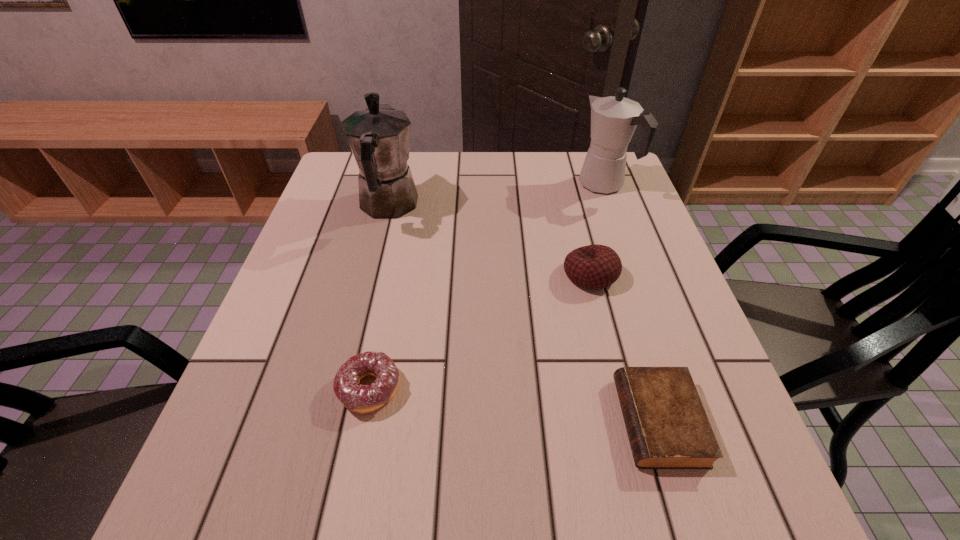
Find the location of `object that is at the far left corner`. object that is at the far left corner is located at coordinates (379, 137).

What are the coordinates of `object present at the far right corner` in the screenshot? It's located at (613, 119).

Image resolution: width=960 pixels, height=540 pixels. Identify the location of object at the near right corner. (667, 426).

This screenshot has width=960, height=540. I want to click on vacant space at the far edge of the desktop, so click(544, 186).

In order to click on blank space at the near edge of the desktop in this screenshot , I will do `click(625, 509)`.

Locate an element on the screen. The image size is (960, 540). free region at the left edge is located at coordinates (252, 358).

This screenshot has height=540, width=960. In the image, there is a desktop. What are the coordinates of `vacant space at the right edge` in the screenshot? It's located at (660, 355).

Identify the location of vacant area at the far right corner. (631, 179).

This screenshot has width=960, height=540. I want to click on vacant area that lies between the left coffeepot and the beanbag, so click(490, 240).

The height and width of the screenshot is (540, 960). I want to click on free space between the beanbag and the right coffeepot, so tap(598, 230).